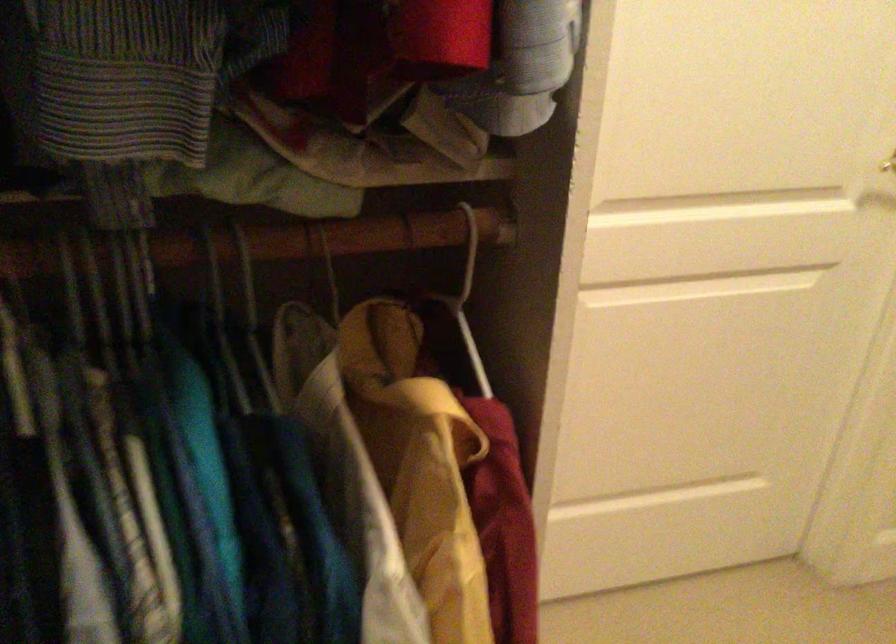
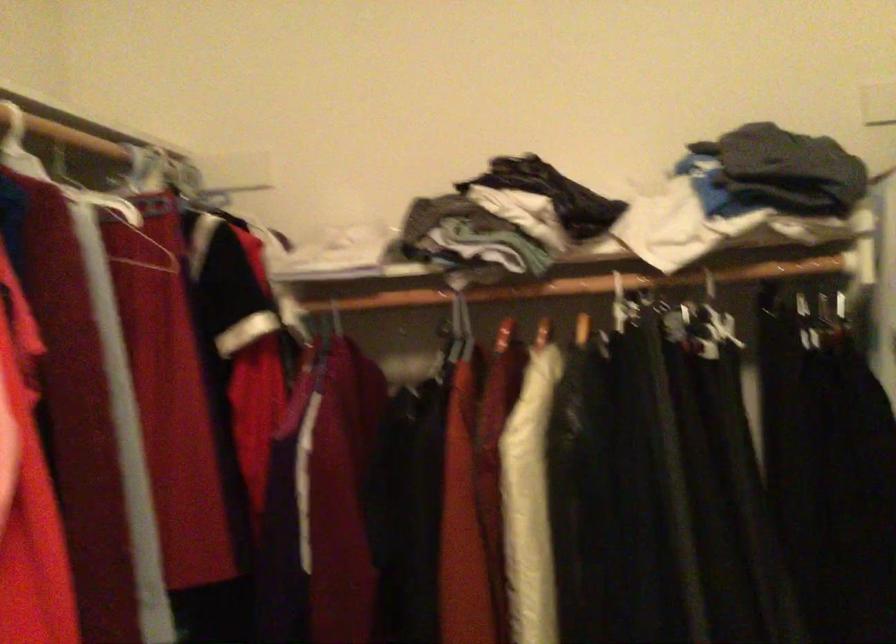
Question: How did the camera likely rotate?

Choices:
 (A) Left
 (B) Right
 (C) Up
 (D) Down

Answer: (A)